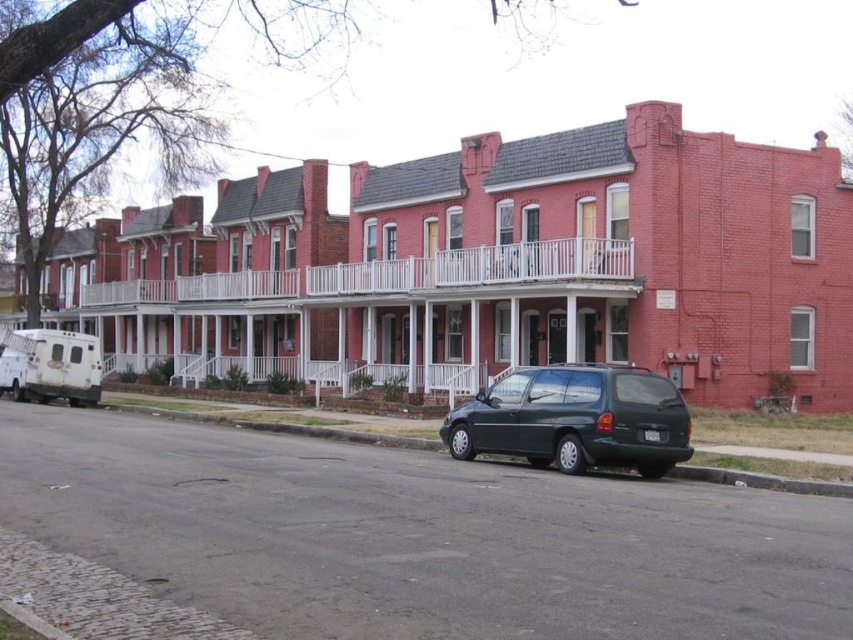
You are a delivery driver who needs to park your vehicle on the dark gray asphalt at lower center. However, there is a green matte minivan at center already occupying part of the space. Based on their positions, can you still park your vehicle there?

The green matte minivan at center is to the right of the dark gray asphalt at lower center, so there might still be space available on the left side of the asphalt area to park your vehicle.

You are a delivery person needing to unload a package that requires a 5 meter clearance area. You see the white matte van at left and the dark gray asphalt at lower center. Is the space between them sufficient for your task?

The distance between the white matte van at left and the dark gray asphalt at lower center is 4.69 meters, which is less than the required 5 meters clearance. Therefore, the space is insufficient for unloading the package.